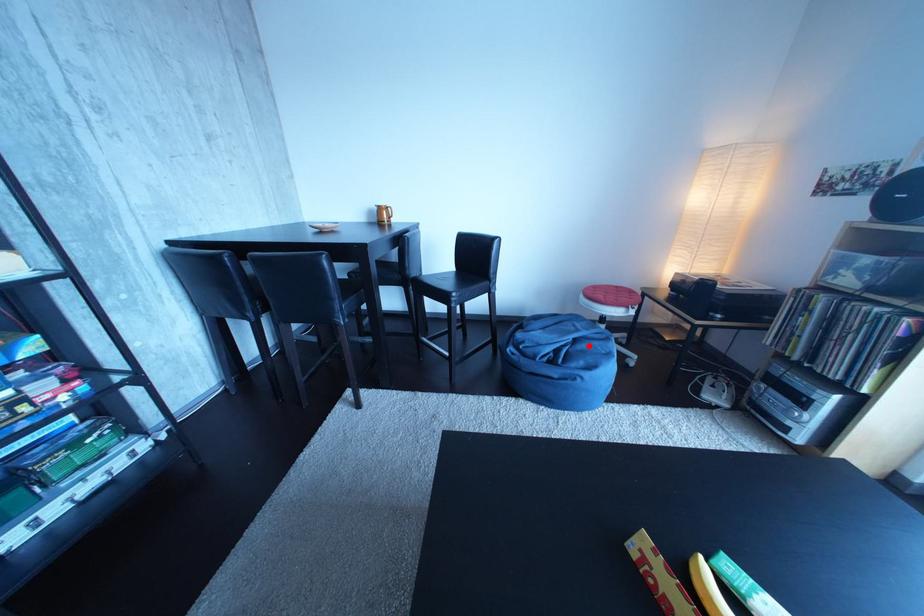
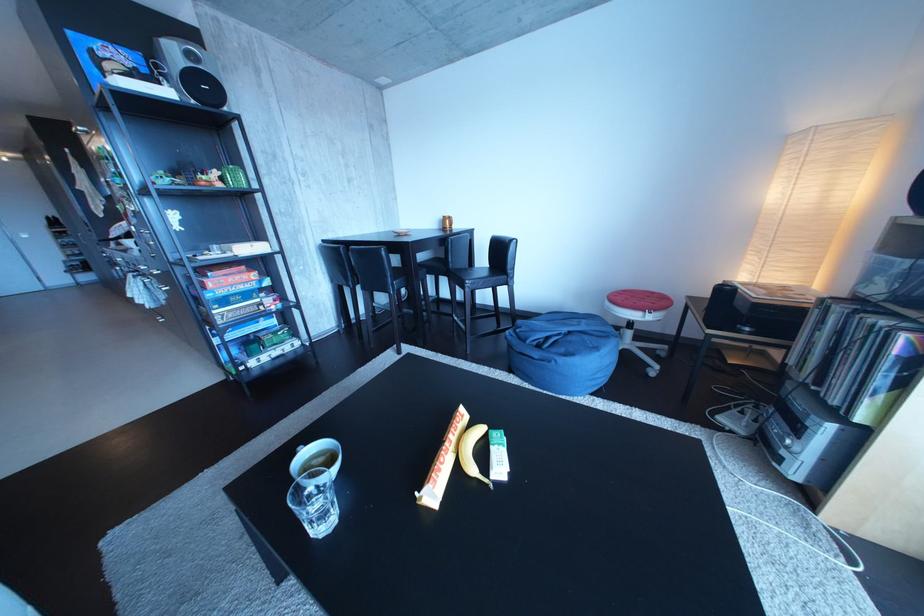
Find the pixel in the second image that matches the highlighted location in the first image.

(582, 339)